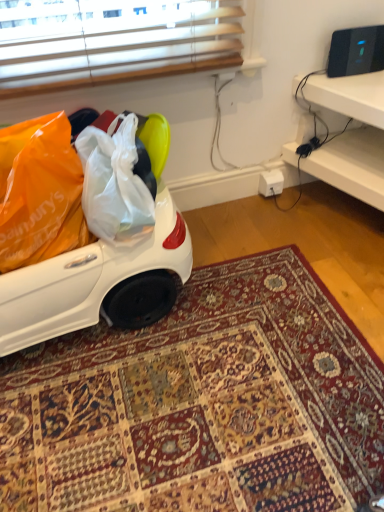
Where is `blank space above carpeted rug at center (from a real-world perspective)`? The image size is (384, 512). blank space above carpeted rug at center (from a real-world perspective) is located at coordinates (211, 360).